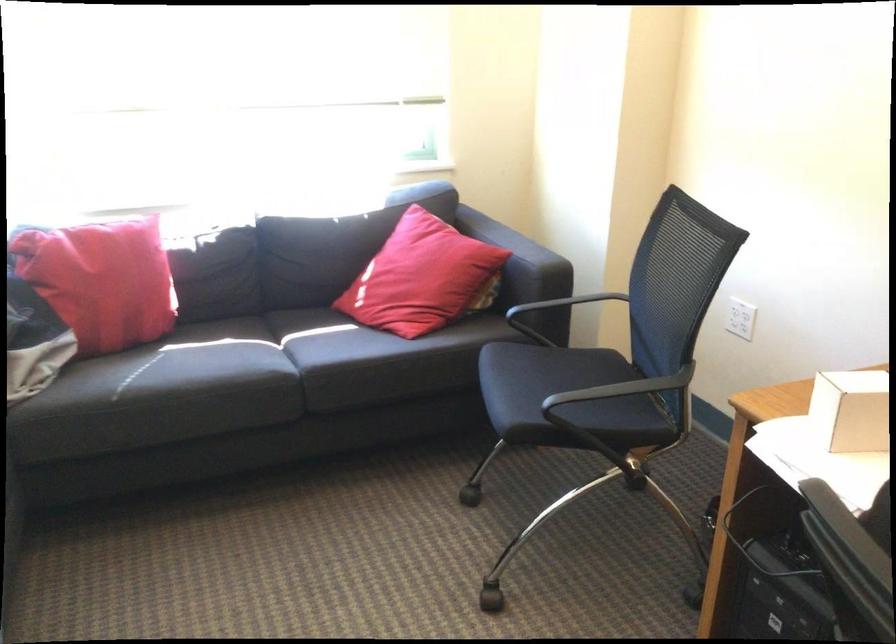
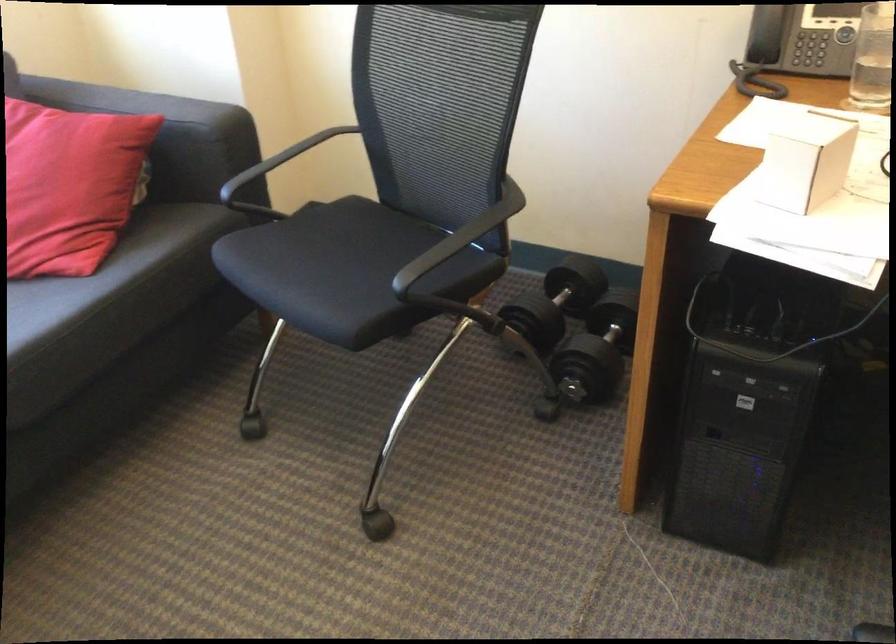
The point at [428,275] is marked in the first image. Where is the corresponding point in the second image?

(69, 185)